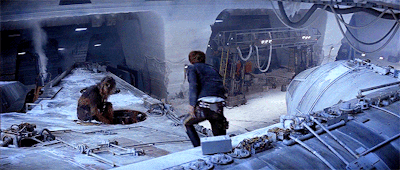
Locate an element on the screen. box is located at coordinates (217, 145).